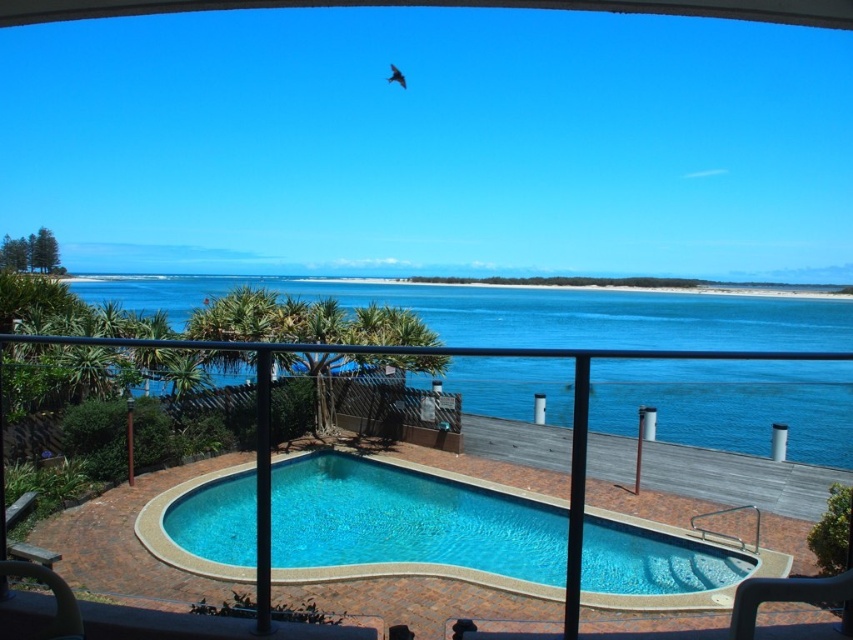
Looking at this image, you are standing on the balcony overlooking the pool and the coastal walkway. You notice two points marked in the scene. From your vantage point, which point is closer to you, point [526,515] or point [573,460]?

Point [573,460] is closer to you because the Objects Description states that point [526,515] is behind point [573,460].